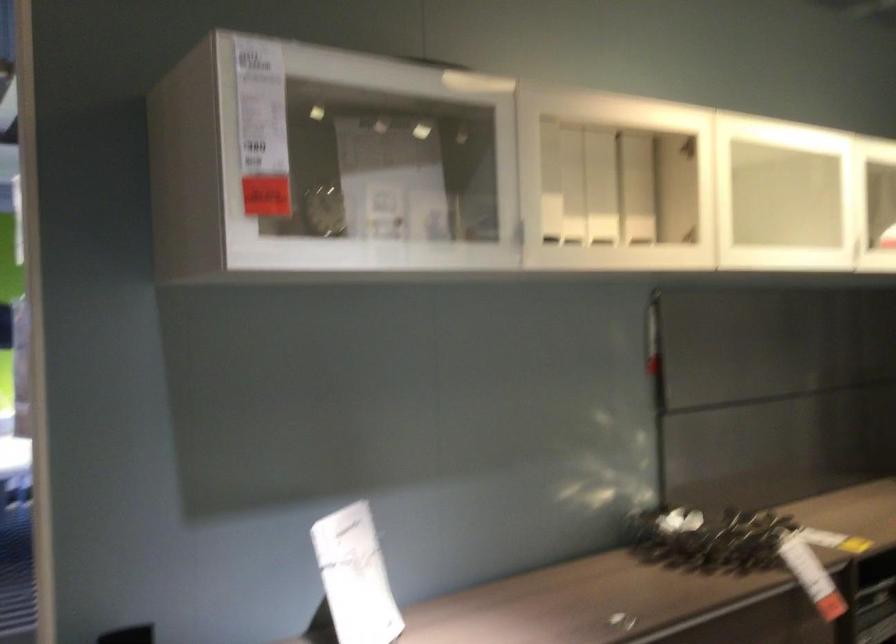
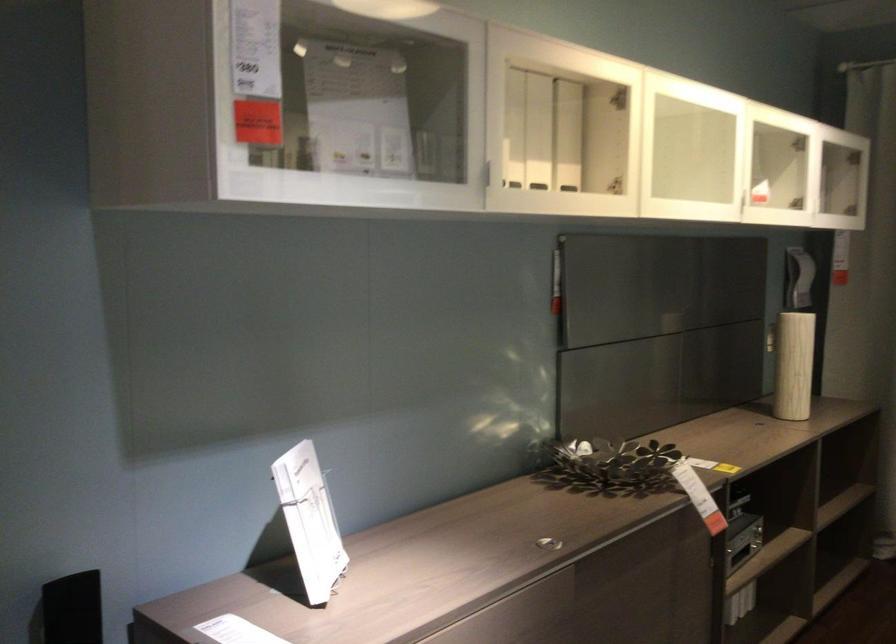
Locate, in the second image, the point that corresponds to (599,185) in the first image.

(538, 131)